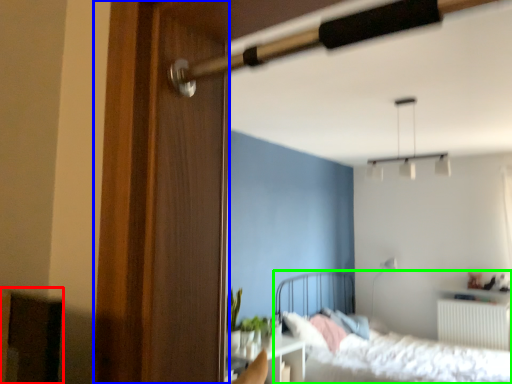
Question: Which object is the closest to the furniture (highlighted by a red box)? Choose among these: screen door (highlighted by a blue box) or bed (highlighted by a green box).

Choices:
 (A) screen door
 (B) bed

Answer: (A)